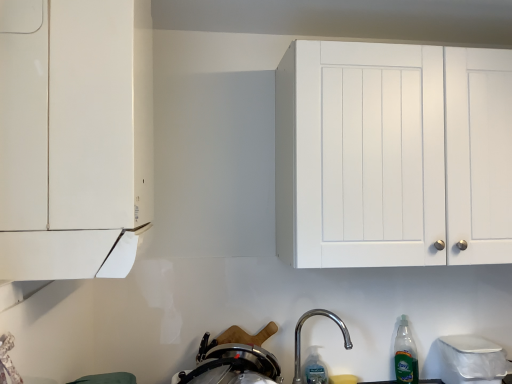
This screenshot has width=512, height=384. What do you see at coordinates (234, 357) in the screenshot?
I see `stainless steel pot at lower center` at bounding box center [234, 357].

I want to click on white matte cabinet at upper right, marked as the second cabinetry in a left-to-right arrangement, so (x=393, y=155).

Considering the relative sizes of white matte cabinet at upper right, which appears as the first cabinetry when viewed from the back, and clear plastic bottle at lower center, positioned as the second bottle in right-to-left order, in the image provided, is white matte cabinet at upper right, which appears as the first cabinetry when viewed from the back, taller than clear plastic bottle at lower center, positioned as the second bottle in right-to-left order,?

Correct, white matte cabinet at upper right, which appears as the first cabinetry when viewed from the back, is much taller as clear plastic bottle at lower center, positioned as the second bottle in right-to-left order.

This screenshot has height=384, width=512. I want to click on the 2nd bottle below the white matte cabinet at upper right, which appears as the second cabinetry when viewed from the front (from the image's perspective), so click(314, 369).

From the image's perspective, which one is positioned higher, white matte cabinet at upper right, marked as the second cabinetry in a left-to-right arrangement, or clear plastic bottle at lower center, positioned as the second bottle in right-to-left order?

white matte cabinet at upper right, marked as the second cabinetry in a left-to-right arrangement, from the image's perspective.

Does white matte cabinet at upper right, which appears as the second cabinetry when viewed from the front, have a smaller size compared to clear plastic bottle at lower center, which appears as the 1th bottle when viewed from the left?

Incorrect, white matte cabinet at upper right, which appears as the second cabinetry when viewed from the front, is not smaller in size than clear plastic bottle at lower center, which appears as the 1th bottle when viewed from the left.

Which is behind, point (300, 336) or point (307, 362)?

The point (300, 336) is more distant.

Image resolution: width=512 pixels, height=384 pixels. Identify the location of tap in front of the clear plastic bottle at lower center, positioned as the second bottle in right-to-left order. (300, 336).

Is polished metallic faucet at lower center thinner than clear plastic bottle at lower center, positioned as the second bottle in right-to-left order?

No, polished metallic faucet at lower center is not thinner than clear plastic bottle at lower center, positioned as the second bottle in right-to-left order.

Is clear plastic bottle at lower center, positioned as the second bottle in right-to-left order, looking in the opposite direction of stainless steel pot at lower center?

No, clear plastic bottle at lower center, positioned as the second bottle in right-to-left order,'s orientation is not away from stainless steel pot at lower center.

From the image's perspective, is clear plastic bottle at lower center, which appears as the 1th bottle when viewed from the left, beneath stainless steel pot at lower center?

Yes, from the image's perspective, clear plastic bottle at lower center, which appears as the 1th bottle when viewed from the left, is below stainless steel pot at lower center.

From a real-world perspective, which object rests below the other?

clear plastic bottle at lower center, positioned as the second bottle in right-to-left order, from a real-world perspective.

Between clear plastic bottle at lower center, positioned as the second bottle in right-to-left order, and stainless steel pot at lower center, which one has larger width?

stainless steel pot at lower center is wider.

Does green translucent bottle at lower right, which is counted as the first bottle, starting from the right, come in front of stainless steel pot at lower center?

No, green translucent bottle at lower right, which is counted as the first bottle, starting from the right, is behind stainless steel pot at lower center.

Is green translucent bottle at lower right, the second bottle viewed from the left, beside stainless steel pot at lower center?

No, green translucent bottle at lower right, the second bottle viewed from the left, is not with stainless steel pot at lower center.

How many degrees apart are the facing directions of polished metallic faucet at lower center and white matte cabinet at left, marked as the first cabinetry in a left-to-right arrangement?

90 degrees separate the facing orientations of polished metallic faucet at lower center and white matte cabinet at left, marked as the first cabinetry in a left-to-right arrangement.

Between polished metallic faucet at lower center and white matte cabinet at left, marked as the first cabinetry in a left-to-right arrangement, which one has more height?

With more height is white matte cabinet at left, marked as the first cabinetry in a left-to-right arrangement.

Is polished metallic faucet at lower center directly adjacent to white matte cabinet at left, marked as the first cabinetry in a left-to-right arrangement?

polished metallic faucet at lower center is not next to white matte cabinet at left, marked as the first cabinetry in a left-to-right arrangement, and they're not touching.

Does clear plastic bottle at lower center, which appears as the 1th bottle when viewed from the left, touch green translucent bottle at lower right, which is counted as the first bottle, starting from the right?

No.

From a real-world perspective, which object rests below the other?

clear plastic bottle at lower center, positioned as the second bottle in right-to-left order, is physically lower.

Is clear plastic bottle at lower center, which appears as the 1th bottle when viewed from the left, not within green translucent bottle at lower right, the second bottle viewed from the left?

Absolutely, clear plastic bottle at lower center, which appears as the 1th bottle when viewed from the left, is external to green translucent bottle at lower right, the second bottle viewed from the left.

Is clear plastic bottle at lower center, positioned as the second bottle in right-to-left order, thinner than green translucent bottle at lower right, which is counted as the first bottle, starting from the right?

Correct, the width of clear plastic bottle at lower center, positioned as the second bottle in right-to-left order, is less than that of green translucent bottle at lower right, which is counted as the first bottle, starting from the right.

Which point is more distant from viewer, (102,3) or (247,360)?

Point (247,360)

Is white matte cabinet at left, the 2th cabinetry in the right-to-left sequence, positioned before stainless steel pot at lower center?

Yes, it is in front of stainless steel pot at lower center.

Could stainless steel pot at lower center be considered to be inside white matte cabinet at left, the second cabinetry when ordered from back to front?

No, white matte cabinet at left, the second cabinetry when ordered from back to front, does not contain stainless steel pot at lower center.

Is white matte cabinet at left, marked as the 1th cabinetry in a front-to-back arrangement, bigger than stainless steel pot at lower center?

Yes, white matte cabinet at left, marked as the 1th cabinetry in a front-to-back arrangement, is bigger than stainless steel pot at lower center.

The width and height of the screenshot is (512, 384). I want to click on cabinetry on the right of clear plastic bottle at lower center, which appears as the 1th bottle when viewed from the left, so click(x=393, y=155).

Identify the location of tap above the clear plastic bottle at lower center, positioned as the second bottle in right-to-left order (from the image's perspective). The image size is (512, 384). [x=300, y=336].

Looking at this image, when comparing their distances from stainless steel pot at lower center, does white matte cabinet at left, the second cabinetry when ordered from back to front, or clear plastic bottle at lower center, which appears as the 1th bottle when viewed from the left, seem further?

white matte cabinet at left, the second cabinetry when ordered from back to front, lies further to stainless steel pot at lower center than the other object.

From the picture: Estimate the real-world distances between objects in this image. Which object is closer to clear plastic bottle at lower center, which appears as the 1th bottle when viewed from the left, green translucent bottle at lower right, which is counted as the first bottle, starting from the right, or white matte cabinet at left, marked as the 1th cabinetry in a front-to-back arrangement?

Among the two, green translucent bottle at lower right, which is counted as the first bottle, starting from the right, is located nearer to clear plastic bottle at lower center, which appears as the 1th bottle when viewed from the left.

From the image, which object appears to be nearer to clear plastic bottle at lower center, which appears as the 1th bottle when viewed from the left, green translucent bottle at lower right, which is counted as the first bottle, starting from the right, or polished metallic faucet at lower center?

The object closer to clear plastic bottle at lower center, which appears as the 1th bottle when viewed from the left, is polished metallic faucet at lower center.

Which object lies nearer to the anchor point stainless steel pot at lower center, white matte cabinet at upper right, which appears as the first cabinetry when viewed from the back, or polished metallic faucet at lower center?

Based on the image, polished metallic faucet at lower center appears to be nearer to stainless steel pot at lower center.

When comparing their distances from green translucent bottle at lower right, the second bottle viewed from the left, does clear plastic bottle at lower center, positioned as the second bottle in right-to-left order, or polished metallic faucet at lower center seem further?

clear plastic bottle at lower center, positioned as the second bottle in right-to-left order.

Looking at the image, which one is located further to clear plastic bottle at lower center, positioned as the second bottle in right-to-left order, polished metallic faucet at lower center or white matte cabinet at left, the 2th cabinetry in the right-to-left sequence?

white matte cabinet at left, the 2th cabinetry in the right-to-left sequence.

Estimate the real-world distances between objects in this image. Which object is further from white matte cabinet at upper right, marked as the second cabinetry in a left-to-right arrangement, stainless steel pot at lower center or white matte cabinet at left, marked as the first cabinetry in a left-to-right arrangement?

white matte cabinet at left, marked as the first cabinetry in a left-to-right arrangement, lies further to white matte cabinet at upper right, marked as the second cabinetry in a left-to-right arrangement, than the other object.

Looking at the image, which one is located closer to polished metallic faucet at lower center, clear plastic bottle at lower center, which appears as the 1th bottle when viewed from the left, or green translucent bottle at lower right, the second bottle viewed from the left?

The object closer to polished metallic faucet at lower center is clear plastic bottle at lower center, which appears as the 1th bottle when viewed from the left.

I want to click on tap between white matte cabinet at left, marked as the first cabinetry in a left-to-right arrangement, and white matte cabinet at upper right, the first cabinetry positioned from the right, in the horizontal direction, so click(x=300, y=336).

Image resolution: width=512 pixels, height=384 pixels. Find the location of `appliance between white matte cabinet at upper right, which appears as the first cabinetry when viewed from the back, and clear plastic bottle at lower center, which appears as the 1th bottle when viewed from the left, in the up-down direction`. appliance between white matte cabinet at upper right, which appears as the first cabinetry when viewed from the back, and clear plastic bottle at lower center, which appears as the 1th bottle when viewed from the left, in the up-down direction is located at coordinates (234, 357).

Identify the location of tap between white matte cabinet at upper right, which appears as the second cabinetry when viewed from the front, and green translucent bottle at lower right, the second bottle viewed from the left, in the up-down direction. The width and height of the screenshot is (512, 384). (300, 336).

Find the location of `tap between white matte cabinet at upper right, which appears as the first cabinetry when viewed from the back, and stainless steel pot at lower center from top to bottom`. tap between white matte cabinet at upper right, which appears as the first cabinetry when viewed from the back, and stainless steel pot at lower center from top to bottom is located at coordinates (300, 336).